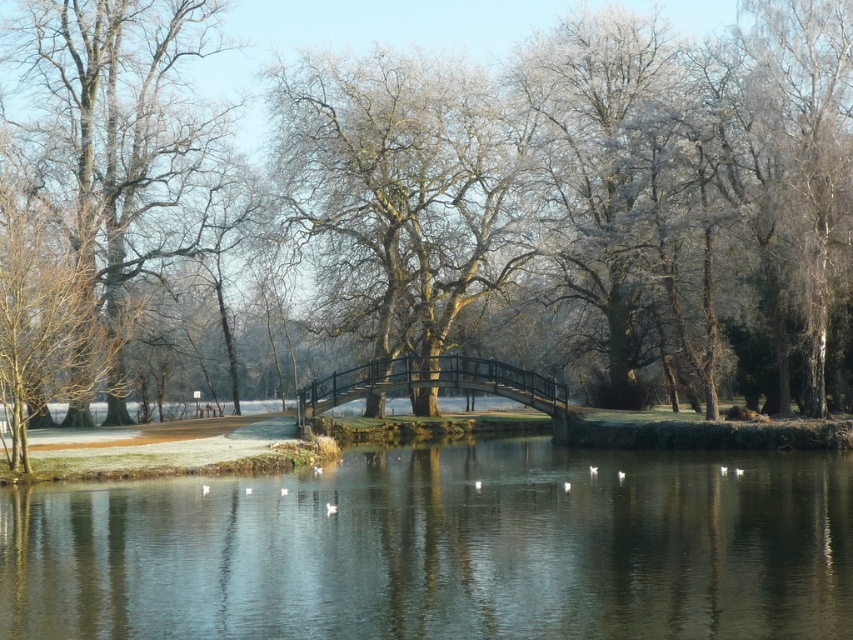
Question: Is transparent glass lake at center further to the viewer compared to black metal bridge at center?

Choices:
 (A) no
 (B) yes

Answer: (A)

Question: Observing the image, what is the correct spatial positioning of frosty bark tree at center in reference to smooth brown tree at left?

Choices:
 (A) below
 (B) above

Answer: (A)

Question: Based on their relative distances, which object is farther from the black metal bridge at center?

Choices:
 (A) transparent glass lake at center
 (B) smooth brown tree at left

Answer: (A)

Question: Which object is the farthest from the transparent glass lake at center?

Choices:
 (A) black metal bridge at center
 (B) frosty bark tree at center

Answer: (A)

Question: Which point appears farthest from the camera in this image?

Choices:
 (A) (264, 561)
 (B) (407, 284)
 (C) (55, 33)
 (D) (422, 380)

Answer: (C)

Question: Does frosty bark tree at center have a greater width compared to smooth brown tree at left?

Choices:
 (A) no
 (B) yes

Answer: (B)